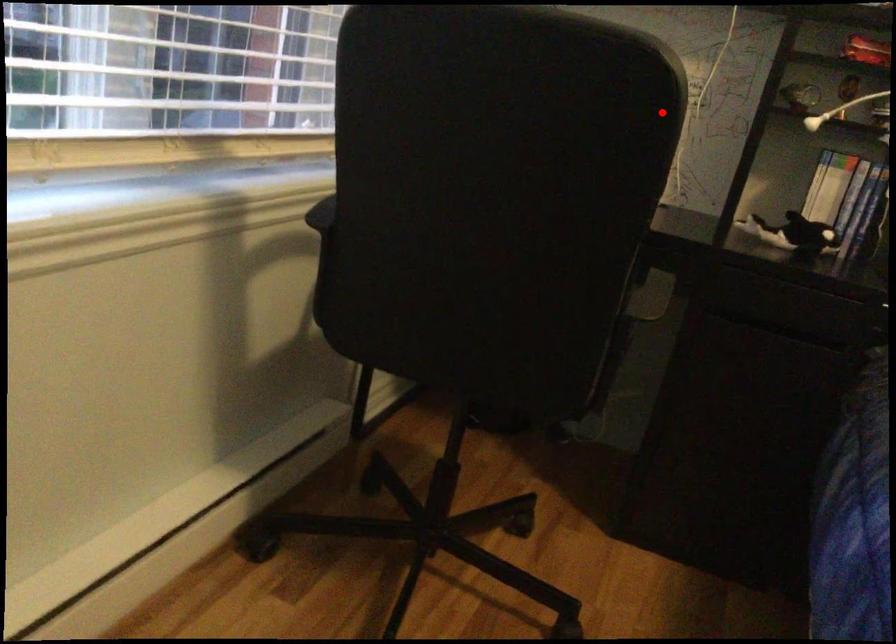
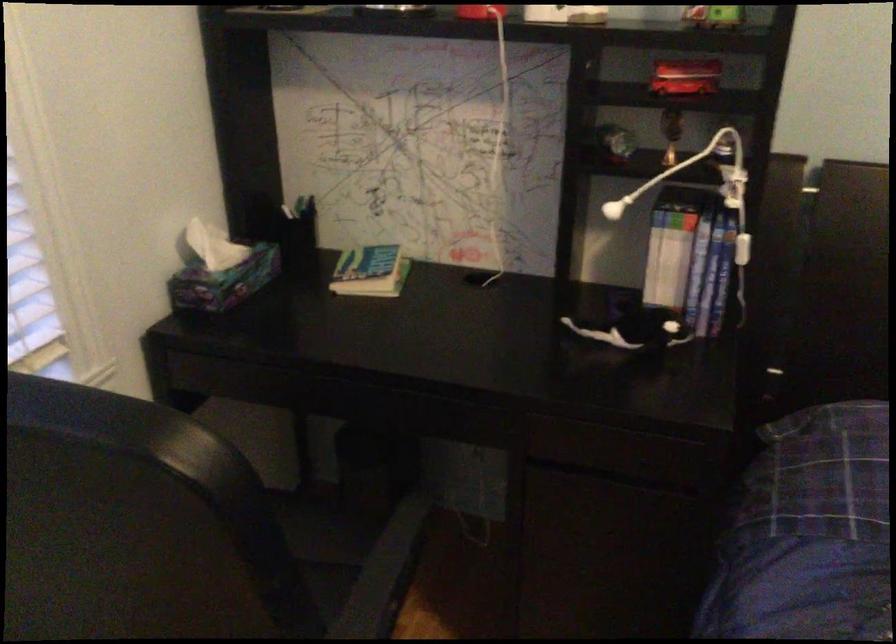
The point at the highlighted location is marked in the first image. Where is the corresponding point in the second image?

(234, 509)